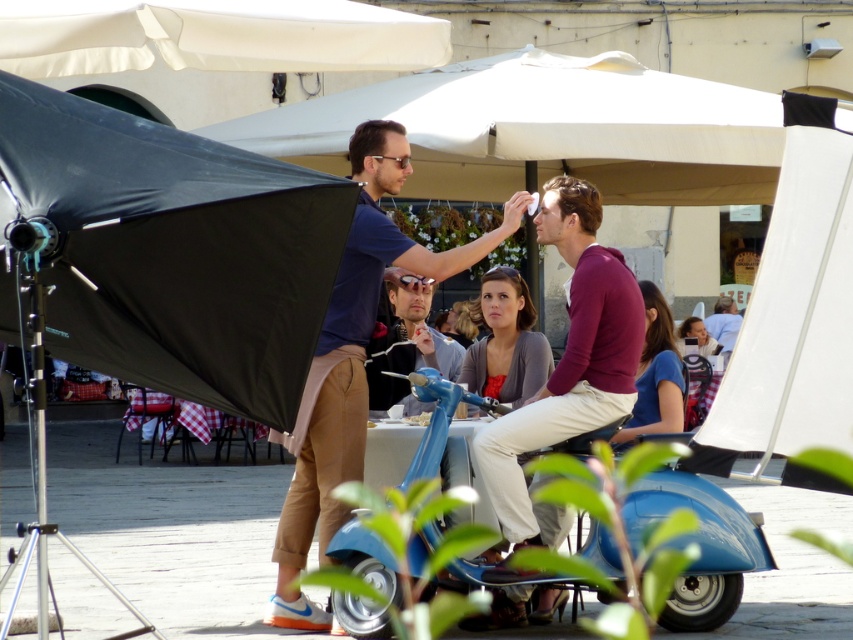
Question: Does black matte umbrella at left have a lesser width compared to blue metallic scooter at center?

Choices:
 (A) no
 (B) yes

Answer: (A)

Question: Which object is closer to the camera taking this photo?

Choices:
 (A) black matte umbrella at left
 (B) blue metallic scooter at center

Answer: (A)

Question: Does blue metallic scooter at center appear on the left side of matte gray sweater at center?

Choices:
 (A) yes
 (B) no

Answer: (A)

Question: Which of these objects is positioned farthest from the blue matte scooter at center?

Choices:
 (A) black matte umbrella at left
 (B) maroon sweater at center

Answer: (A)

Question: Estimate the real-world distances between objects in this image. Which object is closer to the blue cotton shirt at center?

Choices:
 (A) blue metallic scooter at center
 (B) blue matte scooter at center
 (C) maroon sweater at center

Answer: (C)

Question: Is blue metallic scooter at center above maroon sweater at center?

Choices:
 (A) no
 (B) yes

Answer: (A)